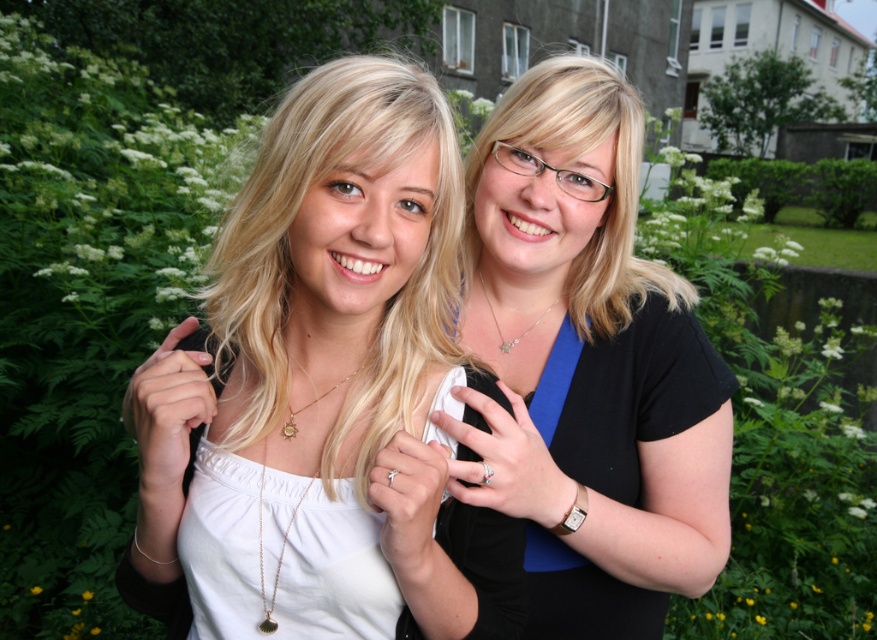
Question: Which point is farther to the camera?

Choices:
 (A) black matte shirt at center
 (B) white matte shirt at center

Answer: (A)

Question: Can you confirm if white matte shirt at center is positioned to the left of black matte shirt at center?

Choices:
 (A) yes
 (B) no

Answer: (A)

Question: Is white matte shirt at center smaller than black matte shirt at center?

Choices:
 (A) yes
 (B) no

Answer: (A)

Question: Is white matte shirt at center to the left of black matte shirt at center from the viewer's perspective?

Choices:
 (A) no
 (B) yes

Answer: (B)

Question: Among these points, which one is nearest to the camera?

Choices:
 (A) [524, 308]
 (B) [297, 378]

Answer: (B)